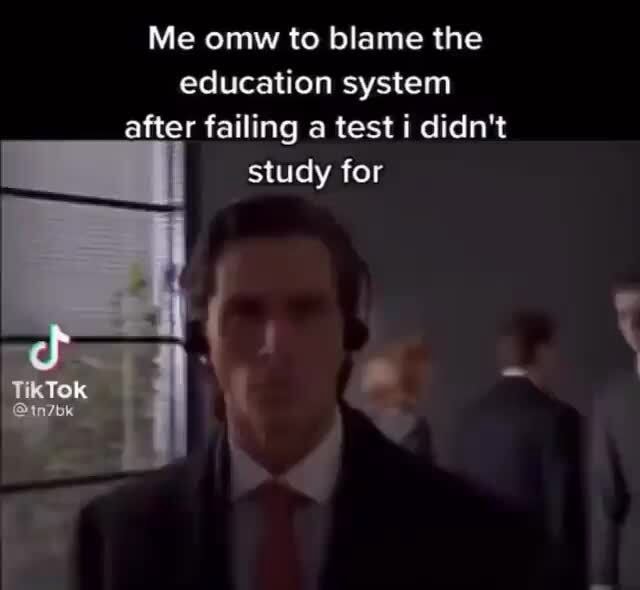
Locate an element on the screen. window is located at coordinates (95, 277).